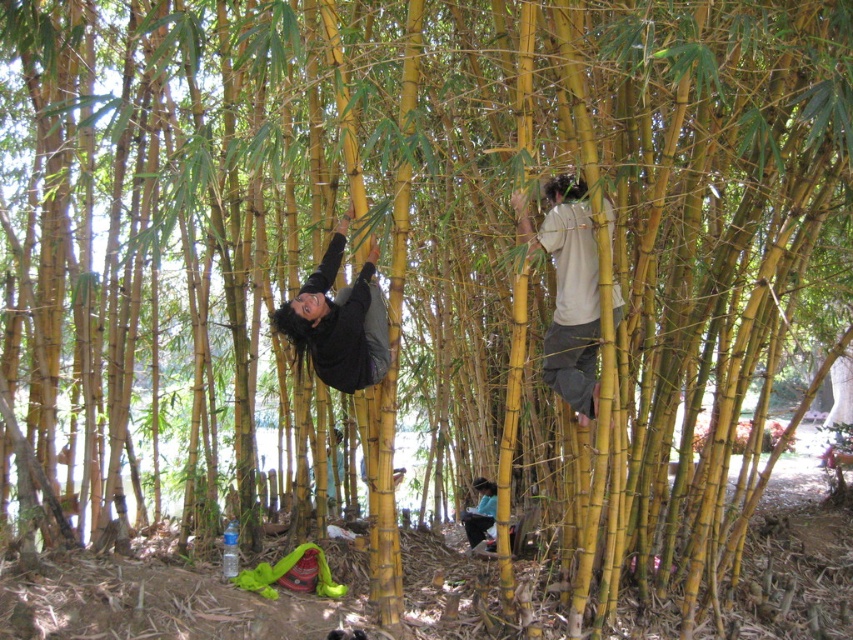
Is black matte shirt at center in front of dark gray fabric at lower center?

That is True.

Measure the distance from black matte shirt at center to dark gray fabric at lower center.

The distance of black matte shirt at center from dark gray fabric at lower center is 2.78 meters.

Find the location of `black matte shirt at center`. black matte shirt at center is located at coordinates (339, 321).

Between white matte shirt at upper right and dark gray fabric at lower center, which one is positioned higher?

white matte shirt at upper right

Which is behind, point (555, 364) or point (482, 492)?

Point (482, 492)

The height and width of the screenshot is (640, 853). Find the location of `white matte shirt at upper right`. white matte shirt at upper right is located at coordinates (567, 291).

Which is behind, point (593, 324) or point (337, 320)?

Positioned behind is point (593, 324).

Where is `white matte shirt at upper right`? white matte shirt at upper right is located at coordinates (567, 291).